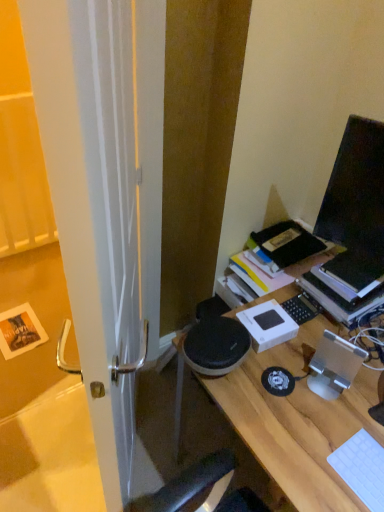
Question: Is hardcover book at upper right wider or thinner than black glossy monitor at upper right?

Choices:
 (A) wide
 (B) thin

Answer: (A)

Question: Would you say hardcover book at upper right is to the left or to the right of black glossy monitor at upper right in the picture?

Choices:
 (A) left
 (B) right

Answer: (B)

Question: Estimate the real-world distances between objects in this image. Which object is closer to the hardcover book at upper right?

Choices:
 (A) black glossy monitor at upper right
 (B) white plastic keyboard at lower right
 (C) white glossy door at left
 (D) wooden desk at center

Answer: (A)

Question: Based on their relative distances, which object is farther from the hardcover book at upper right?

Choices:
 (A) white glossy door at left
 (B) wooden desk at center
 (C) black glossy monitor at upper right
 (D) white plastic keyboard at lower right

Answer: (A)